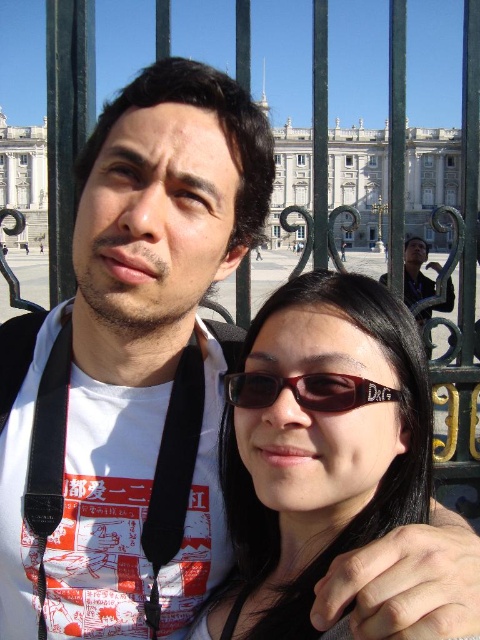
You are a photographer taking a picture of two pairs of sunglasses displayed on a shelf. The black plastic sunglasses at center and the brown matte sunglasses at center are both on the same shelf. Which pair is positioned lower on the shelf?

The black plastic sunglasses at center is positioned lower than the brown matte sunglasses at center on the shelf.

You are standing at point (x=320, y=362) and want to take a photo of the two people in front of the ornate black wrought iron gate. Considering the distance between them, is it possible to capture both in a single frame without moving the camera? Explain your reasoning.

The two people are 102.77 meters apart. Since the distance between them is quite large, it might be challenging to capture both in a single frame without moving the camera, depending on the camera lens and zoom capabilities. However, using a wide angle lens could potentially include both subjects in the shot.